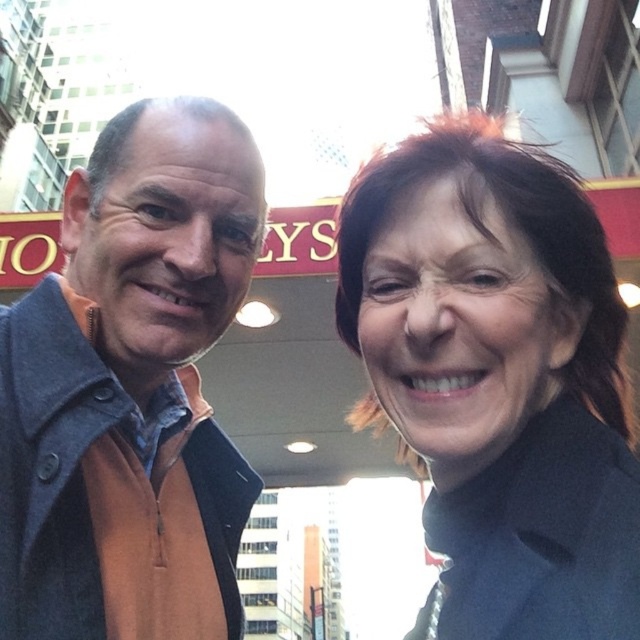
You are trying to decide which person to approach based on their clothing. The orange fleece at left and the matte black coat at upper right are visible. Which clothing item belongs to the person who is wearing a wider garment?

The orange fleece at left is wider than the matte black coat at upper right, so the person wearing the orange fleece at left has the wider garment.

In the scene shown: You are a photographer trying to capture a photo of the matte black coat at upper right without including the orange fleece at left in the frame. Based on their positions, is this possible?

The orange fleece at left is to the left of the matte black coat at upper right, so if you position yourself to the right side of the scene, you can frame the matte black coat at upper right while excluding the orange fleece at left.

You are a photographer trying to focus on the orange fleece at left and the matte black coat at upper right. Which object is positioned lower in the image?

The orange fleece at left is positioned below the matte black coat at upper right, so it is lower in the image.